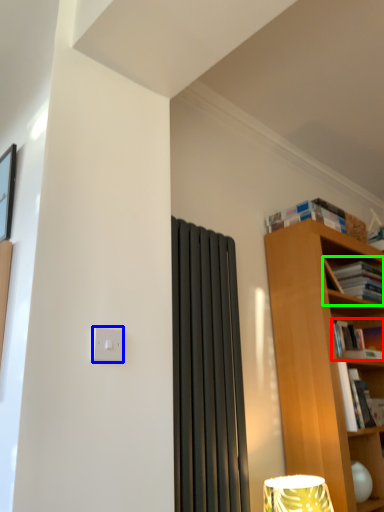
Question: Estimate the real-world distances between objects in this image. Which object is closer to book (highlighted by a red box), light switch (highlighted by a blue box) or book (highlighted by a green box)?

Choices:
 (A) light switch
 (B) book

Answer: (B)